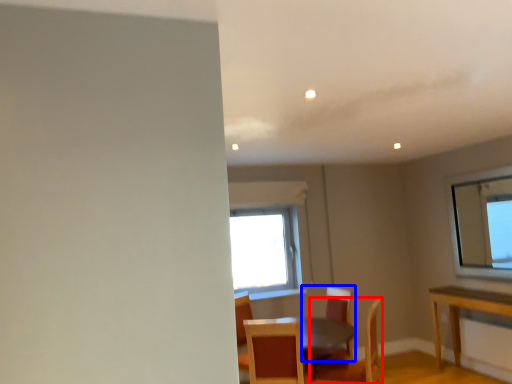
Question: Which point is closer to the camera, chair (highlighted by a red box) or chair (highlighted by a blue box)?

Choices:
 (A) chair
 (B) chair

Answer: (A)